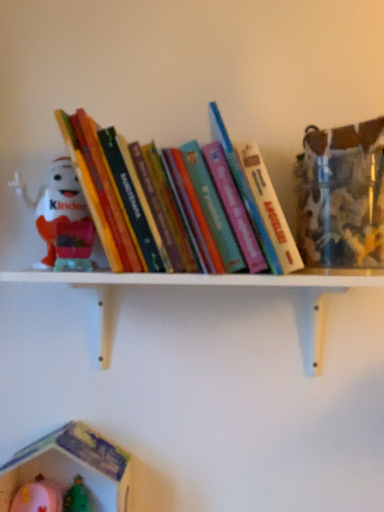
Question: Should I look upward or downward to see plastic toy house at lower left, positioned as the 2th toy in top-to-bottom order?

Choices:
 (A) up
 (B) down

Answer: (B)

Question: From the image's perspective, is matte plastic kinder egg at left, the 1th toy when ordered from top to bottom, over hardcover books at center?

Choices:
 (A) yes
 (B) no

Answer: (B)

Question: From a real-world perspective, does matte plastic kinder egg at left, positioned as the 2th toy in bottom-to-top order, stand above hardcover books at center?

Choices:
 (A) yes
 (B) no

Answer: (B)

Question: Is matte plastic kinder egg at left, the 1th toy when ordered from top to bottom, at the right side of hardcover books at center?

Choices:
 (A) no
 (B) yes

Answer: (A)

Question: Can you confirm if matte plastic kinder egg at left, positioned as the 2th toy in bottom-to-top order, is thinner than hardcover books at center?

Choices:
 (A) no
 (B) yes

Answer: (B)

Question: Considering the relative positions of matte plastic kinder egg at left, the 1th toy when ordered from top to bottom, and hardcover books at center in the image provided, is matte plastic kinder egg at left, the 1th toy when ordered from top to bottom, to the left of hardcover books at center from the viewer's perspective?

Choices:
 (A) no
 (B) yes

Answer: (B)

Question: Can we say matte plastic kinder egg at left, the 1th toy when ordered from top to bottom, lies outside hardcover books at center?

Choices:
 (A) yes
 (B) no

Answer: (B)

Question: Can you confirm if white wooden shelf at upper center is wider than plastic toy house at lower left, positioned as the 2th toy in top-to-bottom order?

Choices:
 (A) yes
 (B) no

Answer: (A)

Question: Is white wooden shelf at upper center bigger than plastic toy house at lower left, marked as the 1th toy in a bottom-to-top arrangement?

Choices:
 (A) yes
 (B) no

Answer: (A)

Question: Does white wooden shelf at upper center have a lesser height compared to plastic toy house at lower left, positioned as the 2th toy in top-to-bottom order?

Choices:
 (A) yes
 (B) no

Answer: (B)

Question: Is white wooden shelf at upper center positioned beyond the bounds of plastic toy house at lower left, positioned as the 2th toy in top-to-bottom order?

Choices:
 (A) no
 (B) yes

Answer: (B)

Question: Can you confirm if white wooden shelf at upper center is thinner than plastic toy house at lower left, positioned as the 2th toy in top-to-bottom order?

Choices:
 (A) yes
 (B) no

Answer: (B)

Question: Can you confirm if white wooden shelf at upper center is smaller than plastic toy house at lower left, positioned as the 2th toy in top-to-bottom order?

Choices:
 (A) yes
 (B) no

Answer: (B)

Question: Is white wooden shelf at upper center turned away from matte plastic kinder egg at left, the 1th toy when ordered from top to bottom?

Choices:
 (A) yes
 (B) no

Answer: (B)